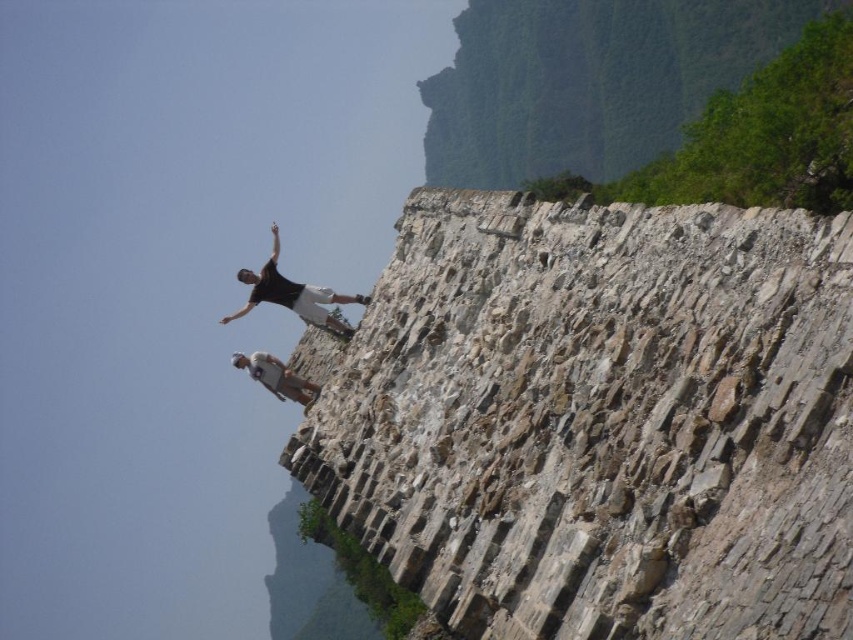
How distant is green leafy hillside at upper center from dark gray stone rock climber at upper center?

green leafy hillside at upper center and dark gray stone rock climber at upper center are 222.73 feet apart.

Who is shorter, green leafy hillside at upper center or dark gray stone rock climber at upper center?

dark gray stone rock climber at upper center

In order to click on green leafy hillside at upper center in this screenshot , I will do `click(589, 81)`.

Which is above, gray stone wall at upper center or white fabric shirt at upper center?

gray stone wall at upper center is above.

Does point (325, 413) lie behind point (302, 396)?

No, (325, 413) is closer to viewer.

Where is `gray stone wall at upper center`? This screenshot has width=853, height=640. gray stone wall at upper center is located at coordinates (598, 419).

Who is positioned more to the left, green leafy hillside at upper center or white fabric shirt at upper center?

Positioned to the left is white fabric shirt at upper center.

Which of these two, green leafy hillside at upper center or white fabric shirt at upper center, stands taller?

green leafy hillside at upper center

Is point (555, 84) positioned before point (293, 376)?

That is False.

Where is `green leafy hillside at upper center`? This screenshot has height=640, width=853. green leafy hillside at upper center is located at coordinates (589, 81).